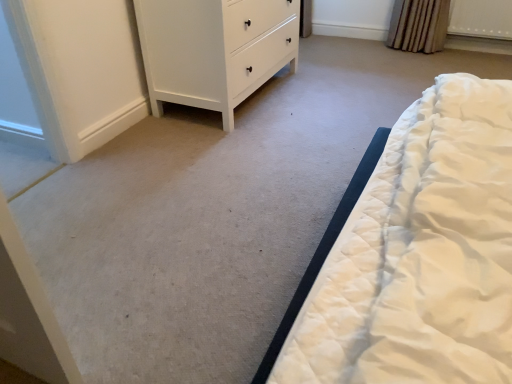
The width and height of the screenshot is (512, 384). I want to click on white plastic radiator at upper right, so click(481, 18).

What do you see at coordinates (481, 18) in the screenshot?
I see `white plastic radiator at upper right` at bounding box center [481, 18].

This screenshot has height=384, width=512. What do you see at coordinates (214, 49) in the screenshot?
I see `white matte chest of drawers at upper left` at bounding box center [214, 49].

This screenshot has width=512, height=384. In order to click on white matte chest of drawers at upper left in this screenshot , I will do `click(214, 49)`.

Measure the distance between point [229,3] and camera.

They are 1.88 meters apart.

Locate an element on the screen. This screenshot has height=384, width=512. white plastic radiator at upper right is located at coordinates (481, 18).

Between white plastic radiator at upper right and white matte chest of drawers at upper left, which one appears on the right side from the viewer's perspective?

white plastic radiator at upper right.

Considering the positions of objects white plastic radiator at upper right and white matte chest of drawers at upper left in the image provided, who is in front, white plastic radiator at upper right or white matte chest of drawers at upper left?

white matte chest of drawers at upper left.

Considering the positions of point (455, 0) and point (216, 5), is point (455, 0) closer or farther from the camera than point (216, 5)?

Clearly, point (455, 0) is more distant from the camera than point (216, 5).

From the image's perspective, is white plastic radiator at upper right above white matte chest of drawers at upper left?

Yes.

From a real-world perspective, which object rests below the other?

white plastic radiator at upper right is physically lower.

Which object is thinner, white plastic radiator at upper right or white matte chest of drawers at upper left?

white plastic radiator at upper right.

Does white plastic radiator at upper right have a greater height compared to white matte chest of drawers at upper left?

In fact, white plastic radiator at upper right may be shorter than white matte chest of drawers at upper left.

Which of these two, white plastic radiator at upper right or white matte chest of drawers at upper left, is smaller?

white plastic radiator at upper right.

Is white plastic radiator at upper right completely or partially outside of white matte chest of drawers at upper left?

Yes, white plastic radiator at upper right is not within white matte chest of drawers at upper left.

Is white plastic radiator at upper right far away from white matte chest of drawers at upper left?

white plastic radiator at upper right is positioned a significant distance from white matte chest of drawers at upper left.

Is white plastic radiator at upper right aimed at white matte chest of drawers at upper left?

No, white plastic radiator at upper right is not facing towards white matte chest of drawers at upper left.

Identify the location of the chest of drawers located in front of the white plastic radiator at upper right. This screenshot has height=384, width=512. (214, 49).

Would you say white matte chest of drawers at upper left is to the left or to the right of white plastic radiator at upper right in the picture?

Based on their positions, white matte chest of drawers at upper left is located to the left of white plastic radiator at upper right.

Consider the image. Between white matte chest of drawers at upper left and white plastic radiator at upper right, which one is positioned in front?

Positioned in front is white matte chest of drawers at upper left.

Between point (217, 89) and point (493, 26), which one is positioned behind?

The point (493, 26) is more distant.

From the image's perspective, which one is positioned lower, white matte chest of drawers at upper left or white plastic radiator at upper right?

white matte chest of drawers at upper left appears lower in the image.

From a real-world perspective, who is located higher, white matte chest of drawers at upper left or white plastic radiator at upper right?

In real-world perspective, white matte chest of drawers at upper left is above.

Which object is wider, white matte chest of drawers at upper left or white plastic radiator at upper right?

Wider between the two is white matte chest of drawers at upper left.

Between white matte chest of drawers at upper left and white plastic radiator at upper right, which one has less height?

white plastic radiator at upper right is shorter.

Does white matte chest of drawers at upper left have a smaller size compared to white plastic radiator at upper right?

No.

Based on the photo, is white matte chest of drawers at upper left surrounding white plastic radiator at upper right?

Definitely not — white plastic radiator at upper right is not inside white matte chest of drawers at upper left.

Is white matte chest of drawers at upper left beside white plastic radiator at upper right?

There is a gap between white matte chest of drawers at upper left and white plastic radiator at upper right.

Does white matte chest of drawers at upper left turn towards white plastic radiator at upper right?

No, white matte chest of drawers at upper left is not oriented towards white plastic radiator at upper right.

How different are the orientations of white matte chest of drawers at upper left and white plastic radiator at upper right in degrees?

white matte chest of drawers at upper left and white plastic radiator at upper right are facing 90.8 degrees away from each other.

This screenshot has height=384, width=512. In the image, there is a white matte chest of drawers at upper left. In order to click on radiator above it (from the image's perspective) in this screenshot , I will do `click(481, 18)`.

Locate an element on the screen. The width and height of the screenshot is (512, 384). chest of drawers located on the left of white plastic radiator at upper right is located at coordinates (214, 49).

Identify the location of chest of drawers below the white plastic radiator at upper right (from the image's perspective). (214, 49).